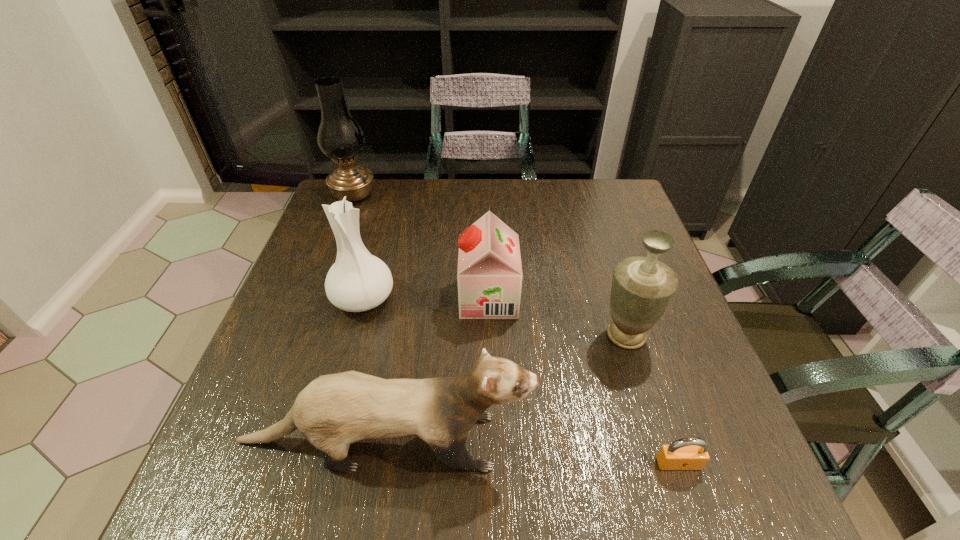
At what (x,y) coordinates should I click in order to perform the action: click on vacant space located on the face of the ferret. Please return your answer as a coordinate pair (x, y). The height and width of the screenshot is (540, 960). Looking at the image, I should click on (616, 441).

Locate an element on the screen. Image resolution: width=960 pixels, height=540 pixels. free location located 0.330m with the cap open on the soya milk is located at coordinates (317, 298).

In order to click on vacant point located 0.060m with the cap open on the soya milk in this screenshot , I will do `click(434, 298)`.

Locate an element on the screen. The image size is (960, 540). vacant space located 0.360m with the cap open on the soya milk is located at coordinates (304, 298).

At what (x,y) coordinates should I click in order to perform the action: click on object positioned at the far edge. Please return your answer as a coordinate pair (x, y). Looking at the image, I should click on (340, 137).

Identify the location of ferret that is at the near edge. (334, 410).

Where is `padlock located in the near edge section of the desktop`? Image resolution: width=960 pixels, height=540 pixels. padlock located in the near edge section of the desktop is located at coordinates (691, 453).

Find the location of a particular element. The height and width of the screenshot is (540, 960). oil lamp present at the left edge is located at coordinates (340, 137).

Identify the location of vase that is at the left edge. (358, 281).

Identify the location of ferret at the left edge. The image size is (960, 540). (334, 410).